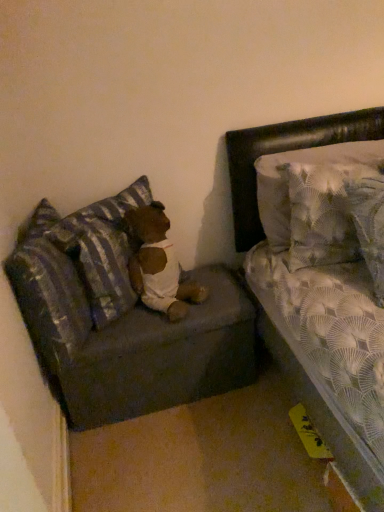
At what (x,y) coordinates should I click in order to perform the action: click on vacant space in front of striped fabric pillow at left, which appears as the second pillow when viewed from the right. Please return your answer as a coordinate pair (x, y). The width and height of the screenshot is (384, 512). Looking at the image, I should click on (132, 327).